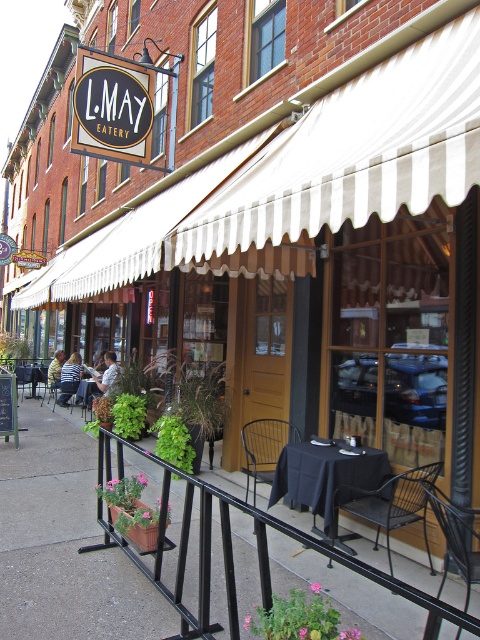
You are a customer arriving at L.May Eatery and want to sit under the white striped awning at center. You see a black metal chair at lower center nearby. Can you estimate if the awning is wide enough to cover the chair?

The white striped awning at center might be wider than black metal chair at lower center, so it is possible that the awning could provide coverage for the chair. However, since the exact dimensions aren

From the picture: You are standing in front of L.May Eatery and want to take a photo of both the entrance and the outdoor seating area. The entrance is at point [261,428] and the outdoor seating area is at point [63,356]. Which point should you focus on first to ensure both are in the frame?

You should focus on point [261,428] first because it is closer to you than point [63,356], ensuring both points are within the camera frame.

You are a customer entering L.May Eatery and see the black wire chair at lower center and the striped shirt at center. Which object is shorter in height?

The black wire chair at lower center is shorter in height compared to the striped shirt at center.